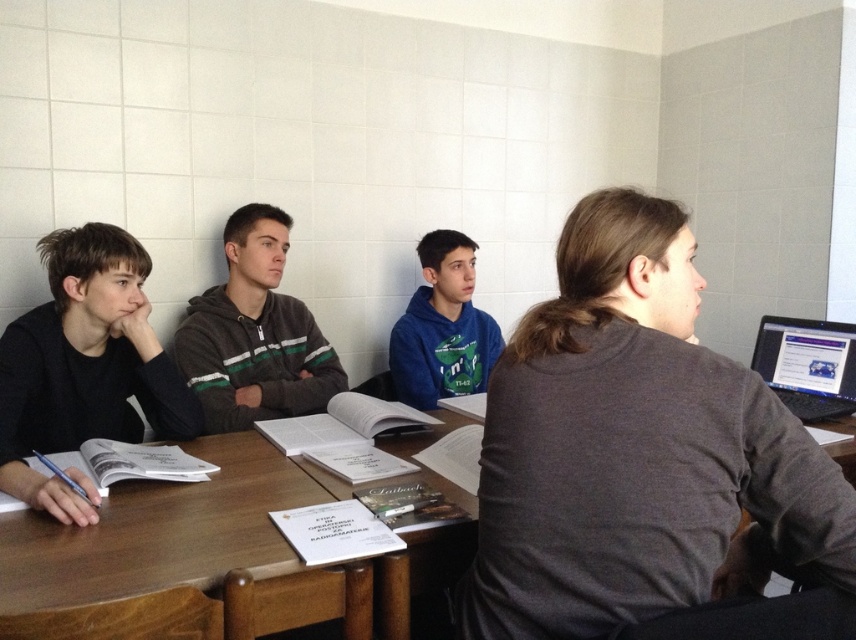
Can you confirm if black matte shirt at left is thinner than black glossy laptop at right?

Incorrect, black matte shirt at left's width is not less than black glossy laptop at right's.

At what (x,y) coordinates should I click in order to perform the action: click on black matte shirt at left. Please return your answer as a coordinate pair (x, y). The width and height of the screenshot is (856, 640). Looking at the image, I should click on (84, 365).

Who is more distant from viewer, (75,378) or (833,323)?

Point (833,323)

The width and height of the screenshot is (856, 640). What are the coordinates of `black matte shirt at left` in the screenshot? It's located at (84, 365).

Which is below, wooden table at center or green striped hoodie at center?

wooden table at center is below.

Who is more distant from viewer, (110, 545) or (281, 214)?

The point (281, 214) is more distant.

Where is `wooden table at center`? wooden table at center is located at coordinates [173, 529].

Is point (419, 472) positioned before point (806, 380)?

That is True.

Identify the location of wooden table at center. This screenshot has width=856, height=640. (173, 529).

Identify the location of wooden table at center. This screenshot has height=640, width=856. (173, 529).